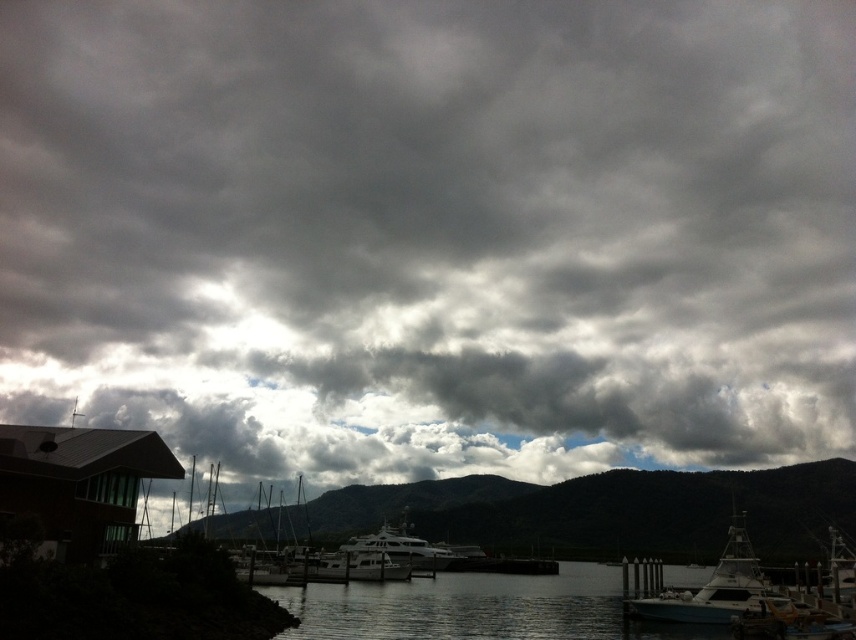
You are a dock worker who needs to ensure that both the white glossy boat at lower right and the metallic silver yacht at center can fit through a narrow channel that is 10 meters wide. Based on their widths, can both vessels pass through the channel simultaneously without touching each other?

The white glossy boat at lower right might be wider than the metallic silver yacht at center, so it is uncertain if both can pass through the 10 meter wide channel simultaneously without touching. Further measurements are needed to confirm their exact widths.

You are a photographer standing at the waterfront. You want to capture a photo that includes both the white glossy boat at lower right and the white glossy yacht at center. Based on their positions, which object should you focus on first to ensure both are in the frame?

The white glossy boat at lower right is below the white glossy yacht at center, so you should focus on the yacht first to ensure both are in the frame.

You are a photographer planning to capture the waterfront scene. You have a camera that can only focus on objects within a 10m focal range. The white glossy boat at lower right and the white glossy yacht at center are both in your frame. Which object is closer to you, and will both fit within the camera range?

The white glossy boat at lower right is larger in size than the white glossy yacht at center. Since the boat is larger, it is likely closer to you. However, without knowing the exact distance, we cannot confirm if both are within the 10m focal range. Adjust your position to ensure both are within range.